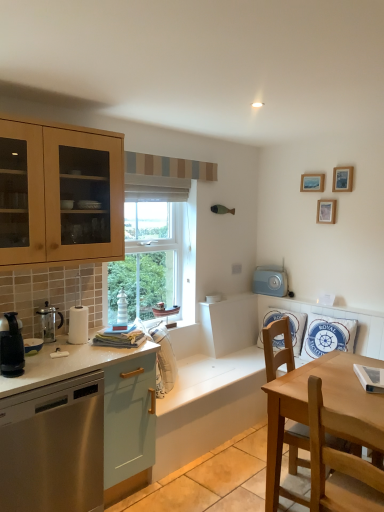
Identify the location of free spot behind black plastic coffee maker at left, arranged as the second kitchen appliance when viewed from the back. click(x=37, y=361).